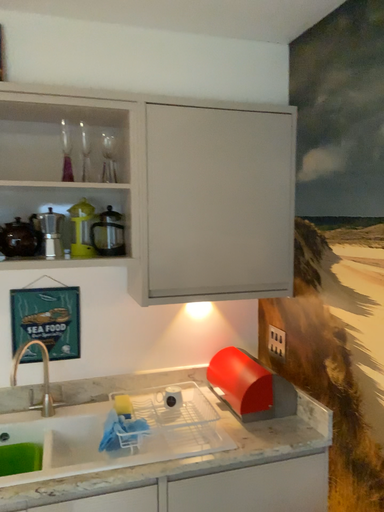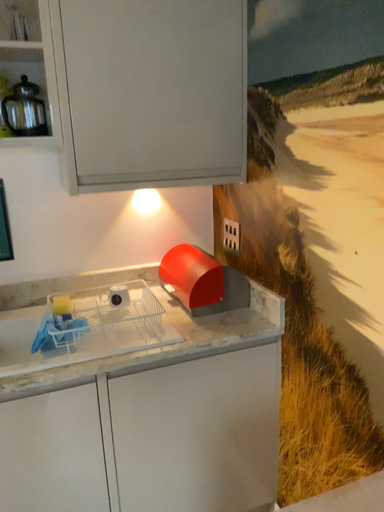
Question: Which way did the camera rotate in the video?

Choices:
 (A) rotated upward
 (B) rotated downward

Answer: (B)